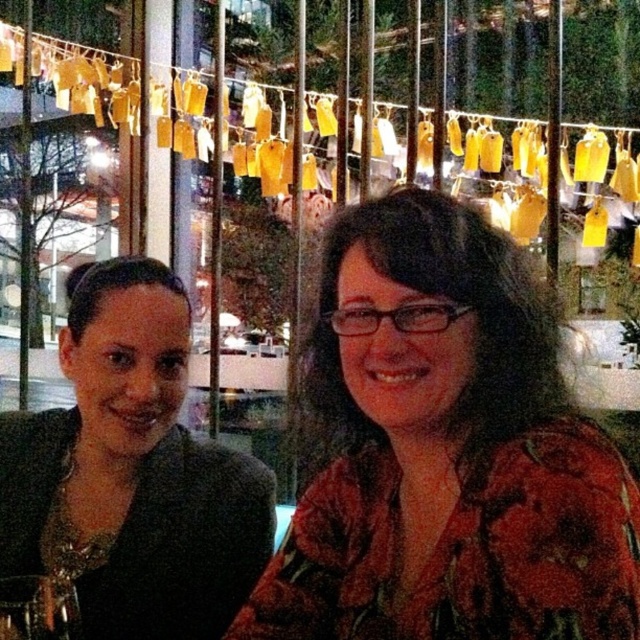
Question: Which object appears farthest from the camera in this image?

Choices:
 (A) floral-patterned shirt at center
 (B) matte black top at left
 (C) transparent glass wine glass at lower left

Answer: (B)

Question: Which of these objects is positioned closest to the floral-patterned shirt at center?

Choices:
 (A) matte black top at left
 (B) transparent glass wine glass at lower left

Answer: (A)

Question: Can you confirm if matte black top at left is positioned to the right of transparent glass wine glass at lower left?

Choices:
 (A) no
 (B) yes

Answer: (B)

Question: Can you confirm if floral-patterned shirt at center is positioned to the left of matte black top at left?

Choices:
 (A) yes
 (B) no

Answer: (B)

Question: Can you confirm if floral-patterned shirt at center is positioned to the right of transparent glass wine glass at lower left?

Choices:
 (A) no
 (B) yes

Answer: (B)

Question: Which of the following is the closest to the observer?

Choices:
 (A) matte black top at left
 (B) floral-patterned shirt at center

Answer: (B)